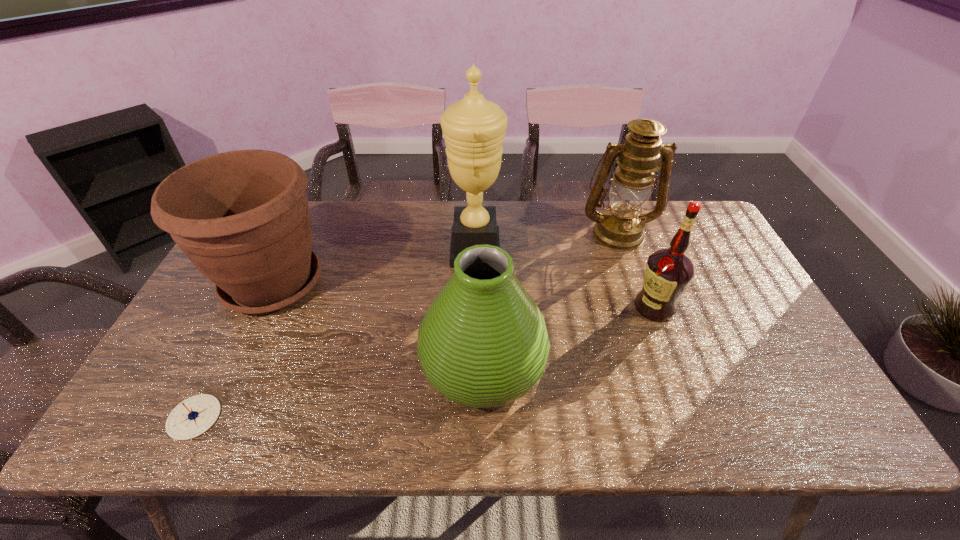
Find the location of `the tallest object`. the tallest object is located at coordinates (474, 128).

Locate an element on the screen. Image resolution: width=960 pixels, height=540 pixels. oil lamp is located at coordinates (621, 227).

Locate an element on the screen. alcohol is located at coordinates (668, 273).

Locate an element on the screen. flowerpot is located at coordinates (242, 217).

Find the location of a particular element. vase is located at coordinates (483, 343).

At what (x,y) coordinates should I click in order to perform the action: click on the shortest object. Please return your answer as a coordinate pair (x, y). The height and width of the screenshot is (540, 960). Looking at the image, I should click on (192, 417).

Identify the location of blank area located 0.130m at the front of the trophy cup with handles. (543, 251).

Locate an element on the screen. The image size is (960, 540). vacant space located 0.380m on the front of the oil lamp is located at coordinates [x=660, y=350].

Locate an element on the screen. This screenshot has width=960, height=540. free space located on the label of the alcohol is located at coordinates (524, 307).

This screenshot has height=540, width=960. Find the location of `vacant space located 0.150m on the label of the alcohol`. vacant space located 0.150m on the label of the alcohol is located at coordinates (579, 307).